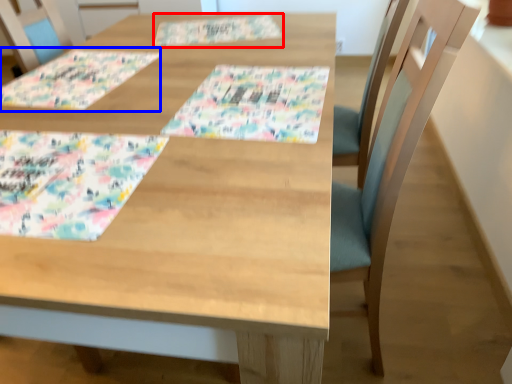
Question: Which object is further to the camera taking this photo, place mat (highlighted by a red box) or place mat (highlighted by a blue box)?

Choices:
 (A) place mat
 (B) place mat

Answer: (A)